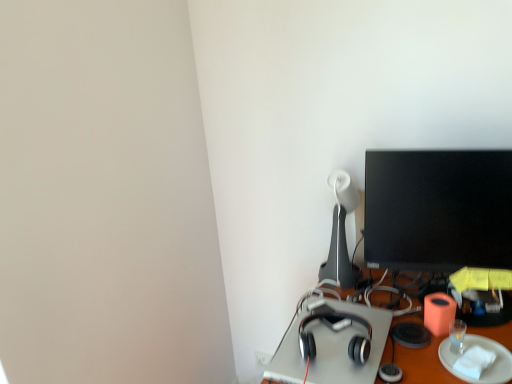
The image size is (512, 384). What do you see at coordinates (336, 331) in the screenshot?
I see `satin silver headphones at center-right` at bounding box center [336, 331].

The height and width of the screenshot is (384, 512). Describe the element at coordinates (341, 233) in the screenshot. I see `white glossy table lamp at upper right` at that location.

Locate an element on the screen. The height and width of the screenshot is (384, 512). black glossy monitor at upper right is located at coordinates (438, 210).

Locate an element on the screen. The image size is (512, 384). satin silver headphones at center-right is located at coordinates (336, 331).

Is black glossy monitor at upper right positioned beyond the bounds of white paper plate at lower right?

Yes, black glossy monitor at upper right is located beyond the bounds of white paper plate at lower right.

Which is behind, black glossy monitor at upper right or white paper plate at lower right?

black glossy monitor at upper right is further away from the camera.

Does point (432, 245) come behind point (490, 369)?

Yes, point (432, 245) is farther from viewer.

How many degrees apart are the facing directions of black glossy monitor at upper right and white paper plate at lower right?

black glossy monitor at upper right and white paper plate at lower right are facing 13.9 degrees away from each other.

From a real-world perspective, is white paper plate at lower right physically above black glossy monitor at upper right?

No, from a real-world perspective, white paper plate at lower right is not above black glossy monitor at upper right.

How different are the orientations of white paper plate at lower right and black glossy monitor at upper right in degrees?

The angular difference between white paper plate at lower right and black glossy monitor at upper right is 13.9 degrees.

Is white paper plate at lower right at the right side of black glossy monitor at upper right?

Indeed, white paper plate at lower right is positioned on the right side of black glossy monitor at upper right.

Is white paper plate at lower right not close to black glossy monitor at upper right?

No, there isn't a large distance between white paper plate at lower right and black glossy monitor at upper right.

Is white glossy table lamp at upper right situated inside black glossy monitor at upper right or outside?

white glossy table lamp at upper right is not enclosed by black glossy monitor at upper right.

Is white glossy table lamp at upper right oriented away from black glossy monitor at upper right?

That's not correct — white glossy table lamp at upper right is not looking away from black glossy monitor at upper right.

Is white glossy table lamp at upper right wider than black glossy monitor at upper right?

Yes.

How many degrees apart are the facing directions of white glossy table lamp at upper right and black glossy monitor at upper right?

There is a 9.91-degree angle between the facing directions of white glossy table lamp at upper right and black glossy monitor at upper right.

Between black glossy monitor at upper right and satin silver headphones at center-right, which one has larger width?

satin silver headphones at center-right is wider.

Considering the sizes of objects black glossy monitor at upper right and satin silver headphones at center-right in the image provided, who is taller, black glossy monitor at upper right or satin silver headphones at center-right?

With more height is black glossy monitor at upper right.

Considering the relative positions of black glossy monitor at upper right and satin silver headphones at center-right in the image provided, is black glossy monitor at upper right behind satin silver headphones at center-right?

Yes, black glossy monitor at upper right is behind satin silver headphones at center-right.

Which is in front, point (343, 234) or point (444, 348)?

The point (444, 348) is more forward.

Is white glossy table lamp at upper right behind white paper plate at lower right?

Yes, it is.

Can you confirm if white glossy table lamp at upper right is positioned to the left of white paper plate at lower right?

Indeed, white glossy table lamp at upper right is positioned on the left side of white paper plate at lower right.

Is white glossy table lamp at upper right smaller than white paper plate at lower right?

No, white glossy table lamp at upper right is not smaller than white paper plate at lower right.

Can we say white glossy table lamp at upper right lies outside satin silver headphones at center-right?

Yes, white glossy table lamp at upper right is located beyond the bounds of satin silver headphones at center-right.

From a real-world perspective, is white glossy table lamp at upper right below satin silver headphones at center-right?

Incorrect, from a real-world perspective, white glossy table lamp at upper right is higher than satin silver headphones at center-right.

Between white glossy table lamp at upper right and satin silver headphones at center-right, which one has larger width?

Wider between the two is satin silver headphones at center-right.

What's the angular difference between white glossy table lamp at upper right and satin silver headphones at center-right's facing directions?

The facing directions of white glossy table lamp at upper right and satin silver headphones at center-right are 16 degrees apart.

Considering the relative positions of white paper plate at lower right and white glossy table lamp at upper right in the image provided, is white paper plate at lower right to the left of white glossy table lamp at upper right from the viewer's perspective?

No, white paper plate at lower right is not to the left of white glossy table lamp at upper right.

Which is in front, white paper plate at lower right or white glossy table lamp at upper right?

Positioned in front is white paper plate at lower right.

Which of these two, white paper plate at lower right or white glossy table lamp at upper right, is bigger?

Bigger between the two is white glossy table lamp at upper right.

Measure the distance between white paper plate at lower right and white glossy table lamp at upper right.

The distance of white paper plate at lower right from white glossy table lamp at upper right is 40.33 centimeters.

You are a GUI agent. You are given a task and a screenshot of the screen. Output one action in this format:
    pyautogui.click(x=<x>, y=<y>)
    Task: Click on the paper plate below the black glossy monitor at upper right (from the image's perspective)
    This screenshot has height=384, width=512.
    Given the screenshot: What is the action you would take?
    pyautogui.click(x=485, y=369)

This screenshot has height=384, width=512. Find the location of `computer monitor that is behind the white paper plate at lower right`. computer monitor that is behind the white paper plate at lower right is located at coordinates (438, 210).

Based on their spatial positions, is satin silver headphones at center-right or white paper plate at lower right further from black glossy monitor at upper right?

satin silver headphones at center-right is further to black glossy monitor at upper right.

Based on their spatial positions, is satin silver headphones at center-right or white glossy table lamp at upper right closer to white paper plate at lower right?

satin silver headphones at center-right is positioned closer to the anchor white paper plate at lower right.

When comparing their distances from satin silver headphones at center-right, does black glossy monitor at upper right or white paper plate at lower right seem closer?

white paper plate at lower right is positioned closer to the anchor satin silver headphones at center-right.

Based on the photo, looking at the image, which one is located closer to black glossy monitor at upper right, white glossy table lamp at upper right or satin silver headphones at center-right?

white glossy table lamp at upper right lies closer to black glossy monitor at upper right than the other object.

Based on their spatial positions, is satin silver headphones at center-right or black glossy monitor at upper right further from white glossy table lamp at upper right?

satin silver headphones at center-right lies further to white glossy table lamp at upper right than the other object.

Which object lies nearer to the anchor point satin silver headphones at center-right, white glossy table lamp at upper right or white paper plate at lower right?

Based on the image, white paper plate at lower right appears to be nearer to satin silver headphones at center-right.

From the image, which object appears to be nearer to satin silver headphones at center-right, black glossy monitor at upper right or white glossy table lamp at upper right?

white glossy table lamp at upper right is closer to satin silver headphones at center-right.

When comparing their distances from white paper plate at lower right, does white glossy table lamp at upper right or satin silver headphones at center-right seem further?

Among the two, white glossy table lamp at upper right is located further to white paper plate at lower right.

At what (x,y) coordinates should I click in order to perform the action: click on table lamp between satin silver headphones at center-right and white paper plate at lower right from left to right. Please return your answer as a coordinate pair (x, y). Looking at the image, I should click on (x=341, y=233).

Locate an element on the screen. Image resolution: width=512 pixels, height=384 pixels. table lamp between black glossy monitor at upper right and white paper plate at lower right in the up-down direction is located at coordinates (341, 233).

At what (x,y) coordinates should I click in order to perform the action: click on headphones between black glossy monitor at upper right and white paper plate at lower right from top to bottom. Please return your answer as a coordinate pair (x, y). Looking at the image, I should click on click(336, 331).

Locate an element on the screen. The image size is (512, 384). table lamp between black glossy monitor at upper right and satin silver headphones at center-right in the up-down direction is located at coordinates (341, 233).